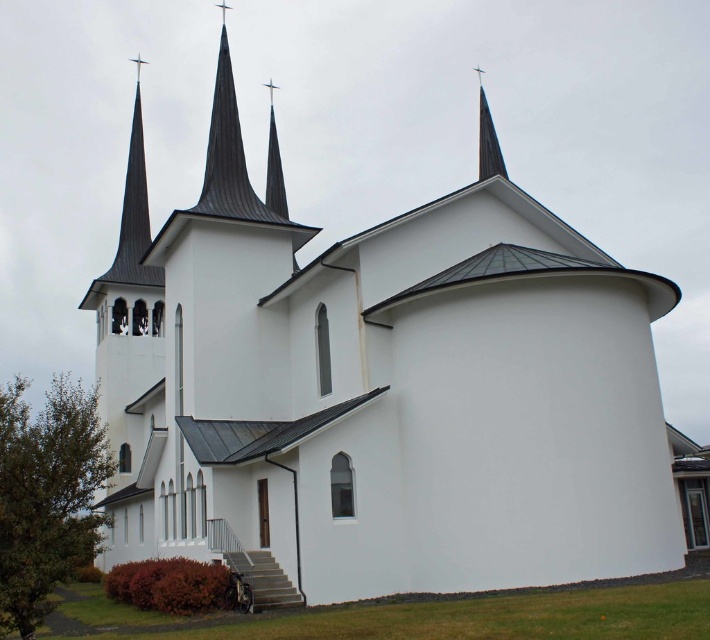
Who is more forward, (x=479, y=70) or (x=283, y=202)?

Point (x=283, y=202)

Measure the distance between shiny metallic spire at upper center and shiny silver spire at center.

shiny metallic spire at upper center and shiny silver spire at center are 21.91 meters apart.

Does point (496, 147) come farther from viewer compared to point (271, 157)?

No, it is not.

Find the location of a particular element. The height and width of the screenshot is (640, 710). shiny metallic spire at upper center is located at coordinates (486, 140).